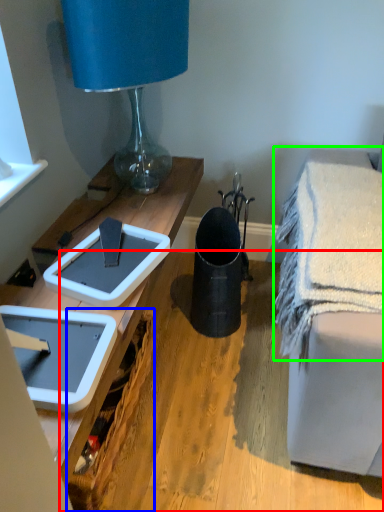
Question: Which is nearer to the wood (highlighted by a red box)? picnic basket (highlighted by a blue box) or bath towel (highlighted by a green box).

Choices:
 (A) picnic basket
 (B) bath towel

Answer: (A)